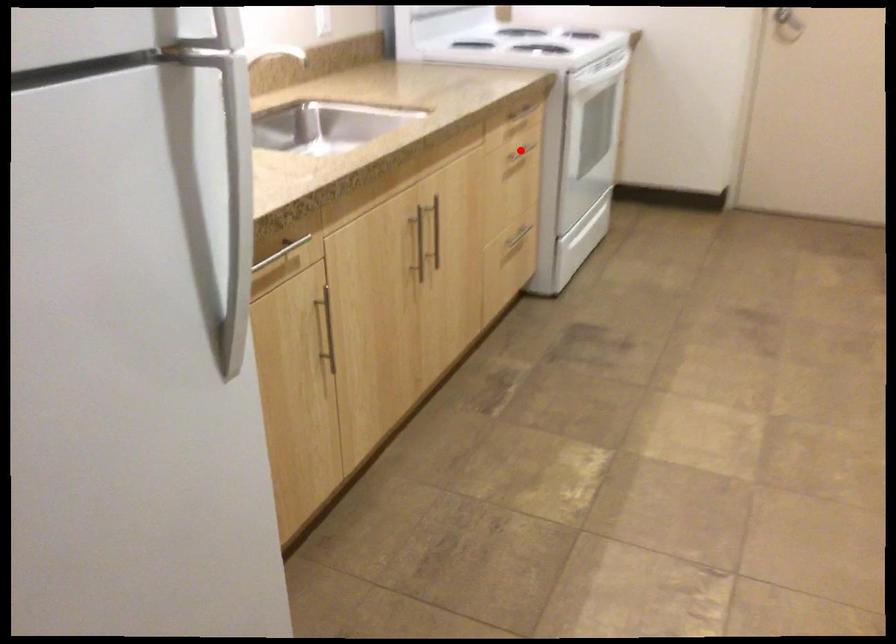
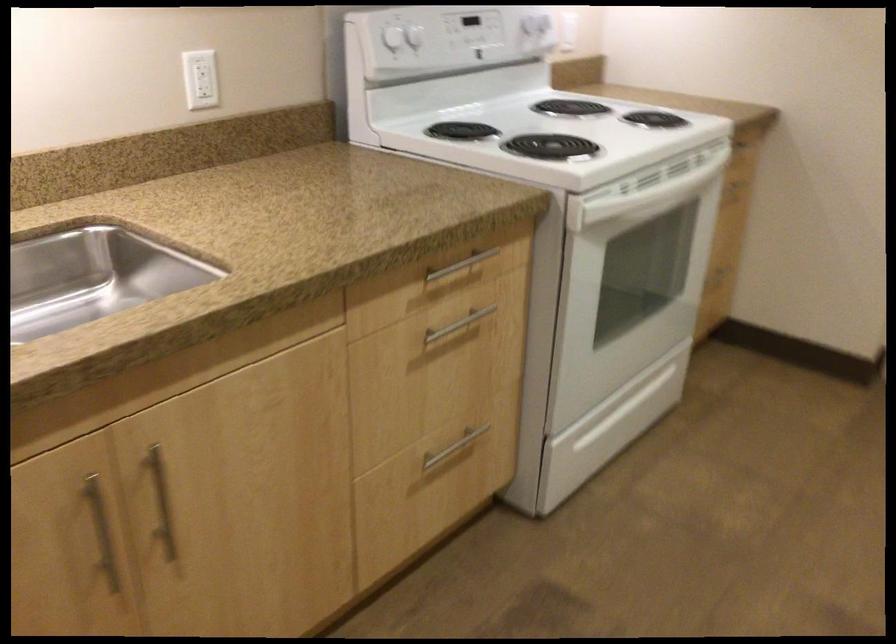
Where in the second image is the point corresponding to the highlighted location from the first image?

(457, 325)